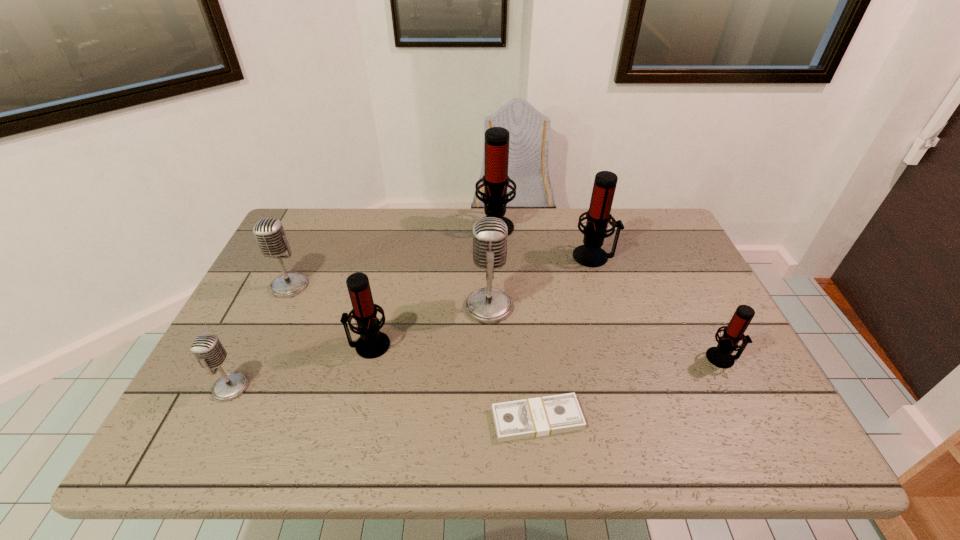
Where is `the farthest red microphone`? the farthest red microphone is located at coordinates (495, 181).

Locate an element on the screen. This screenshot has width=960, height=540. the farthest object is located at coordinates (495, 181).

Where is `the seventh object from left to right`? This screenshot has width=960, height=540. the seventh object from left to right is located at coordinates (598, 216).

Locate an element on the screen. The height and width of the screenshot is (540, 960). the second farthest object is located at coordinates [x=598, y=216].

Locate an element on the screen. The width and height of the screenshot is (960, 540). the rightmost gray microphone is located at coordinates (488, 305).

Find the location of a particular element. the second biggest gray microphone is located at coordinates (269, 232).

Locate an element on the screen. Image resolution: width=960 pixels, height=540 pixels. the leftmost red microphone is located at coordinates (372, 343).

The height and width of the screenshot is (540, 960). Find the location of `the fifth microphone from right to left`. the fifth microphone from right to left is located at coordinates (372, 343).

Locate an element on the screen. The image size is (960, 540). the rightmost microphone is located at coordinates (721, 356).

You are a GUI agent. You are given a task and a screenshot of the screen. Output one action in this format:
    pyautogui.click(x=<x>, y=<y>)
    Task: Click on the rightmost object
    Image resolution: width=960 pixels, height=540 pixels.
    Given the screenshot: What is the action you would take?
    coord(721,356)